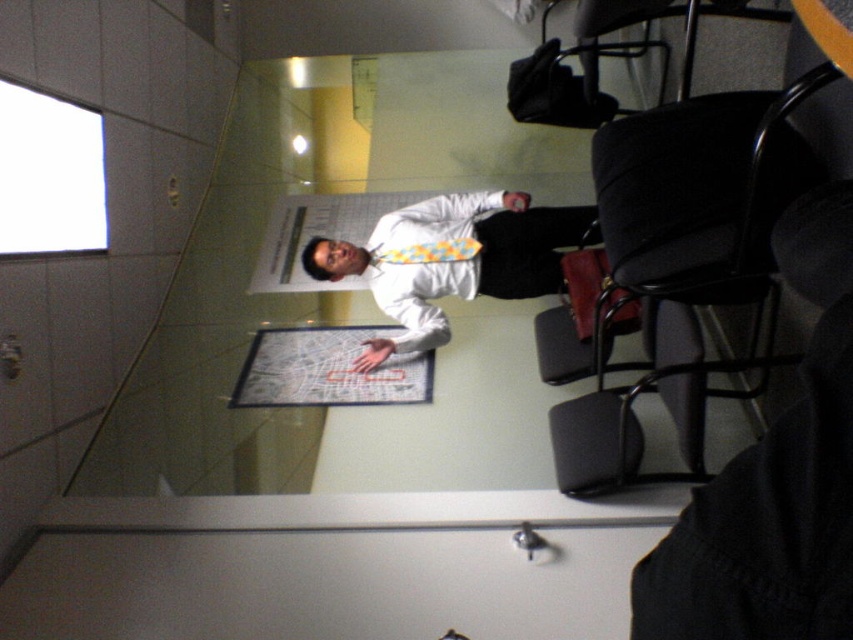
Question: Which of the following is the closest to the observer?

Choices:
 (A) (578, 3)
 (B) (404, 227)

Answer: (A)

Question: Based on their relative distances, which object is farther from the white glossy shirt at center?

Choices:
 (A) white paper clipboard at center
 (B) black plastic chair at upper right
 (C) yellow tie at center

Answer: (B)

Question: Can you confirm if white paper clipboard at center is thinner than yellow tie at center?

Choices:
 (A) yes
 (B) no

Answer: (B)

Question: Which point is closer to the camera?

Choices:
 (A) (351, 284)
 (B) (369, 332)

Answer: (B)

Question: Is white paper clipboard at center above yellow tie at center?

Choices:
 (A) yes
 (B) no

Answer: (B)

Question: Is white glossy shirt at center below white paper clipboard at center?

Choices:
 (A) no
 (B) yes

Answer: (A)